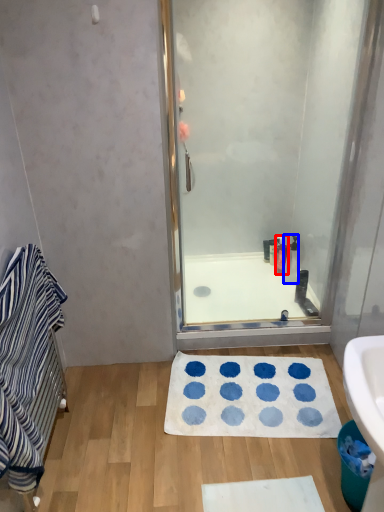
Question: Which point is closer to the camera, toiletry (highlighted by a red box) or toiletry (highlighted by a blue box)?

Choices:
 (A) toiletry
 (B) toiletry

Answer: (B)